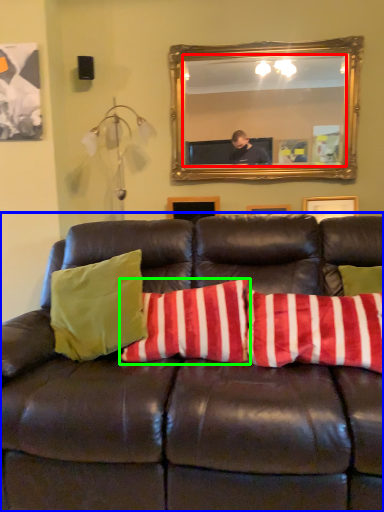
Question: Which object is positioned closest to mirror (highlighted by a red box)? Select from studio couch (highlighted by a blue box) and pillow (highlighted by a green box).

Choices:
 (A) studio couch
 (B) pillow

Answer: (B)